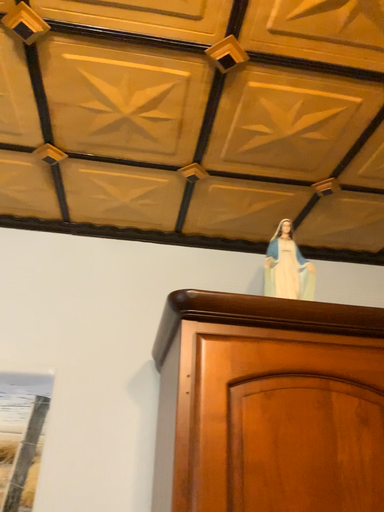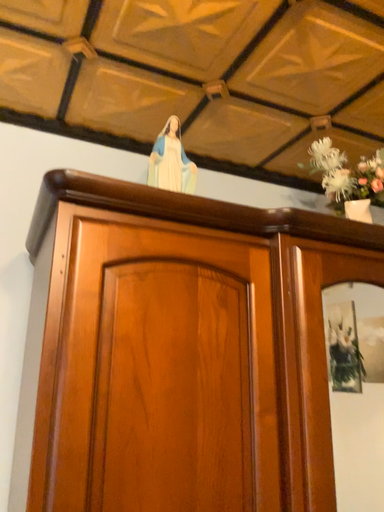
Question: Which way did the camera rotate in the video?

Choices:
 (A) rotated right
 (B) rotated left

Answer: (A)